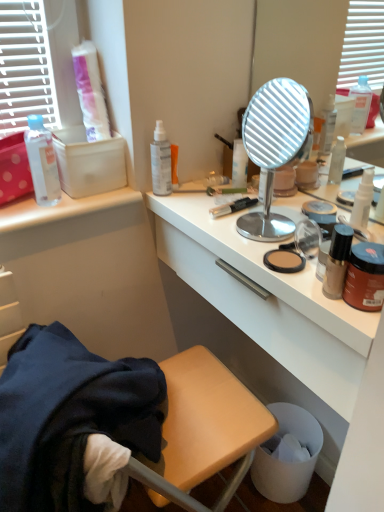
Locate an element on the screen. vacant space that's between metallic round mirror at center and transparent plastic spray bottle at upper center, placed as the 4th bottle when sorted from front to back is located at coordinates (200, 207).